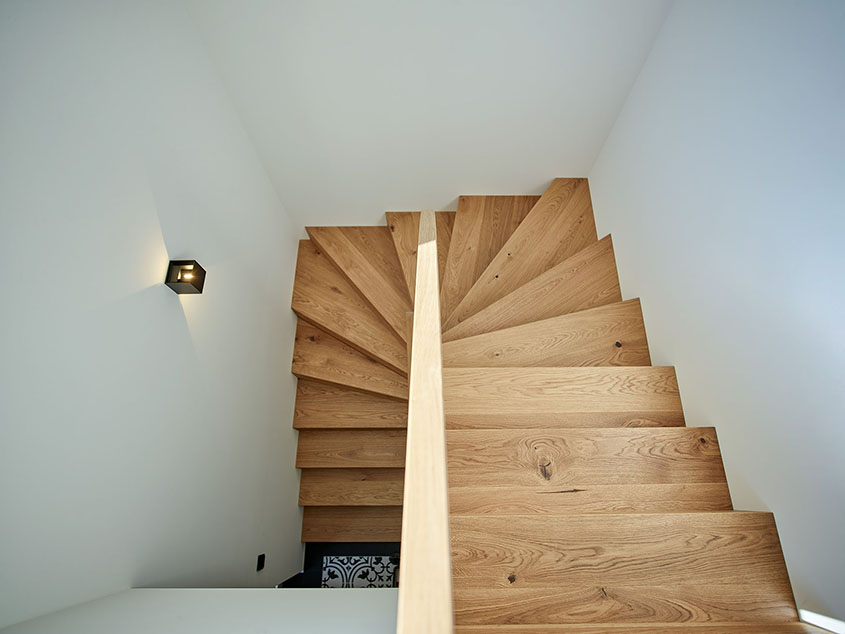
Where is `knots in wood`? knots in wood is located at coordinates (508, 574), (549, 465), (701, 437), (615, 345), (493, 276), (331, 288), (318, 254), (391, 226), (308, 340).